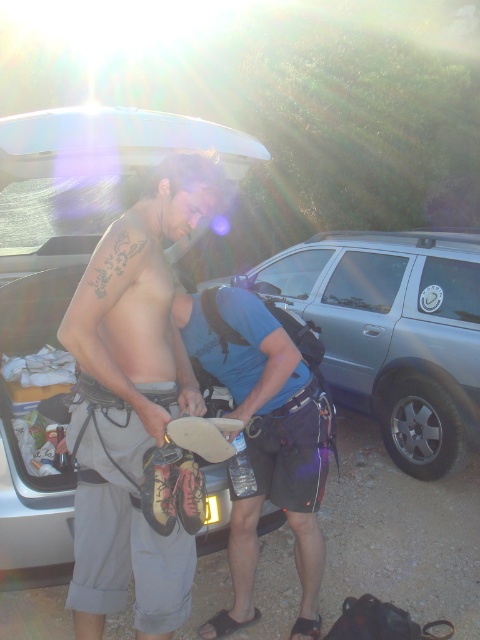
Does gray fabric shorts at center appear under metallic silver minivan at center?

Correct, gray fabric shorts at center is located below metallic silver minivan at center.

Does gray fabric shorts at center come behind metallic silver minivan at center?

That is False.

Who is more distant from viewer, [117,600] or [432,397]?

The point [432,397] is behind.

The image size is (480, 640). I want to click on gray fabric shorts at center, so click(133, 401).

Is gray fabric shorts at center positioned behind blue fabric shirt at center?

No, it is not.

Is the position of gray fabric shorts at center less distant than that of blue fabric shirt at center?

That is True.

Between point (98, 371) and point (259, 380), which one is positioned behind?

Positioned behind is point (259, 380).

Image resolution: width=480 pixels, height=640 pixels. I want to click on gray fabric shorts at center, so click(133, 401).

Can you confirm if metallic silver minivan at center is wider than blue fabric shirt at center?

Indeed, metallic silver minivan at center has a greater width compared to blue fabric shirt at center.

Which is in front, point (283, 257) or point (195, 342)?

Positioned in front is point (195, 342).

This screenshot has width=480, height=640. What do you see at coordinates (394, 332) in the screenshot?
I see `metallic silver minivan at center` at bounding box center [394, 332].

The width and height of the screenshot is (480, 640). What are the coordinates of `metallic silver minivan at center` in the screenshot? It's located at (394, 332).